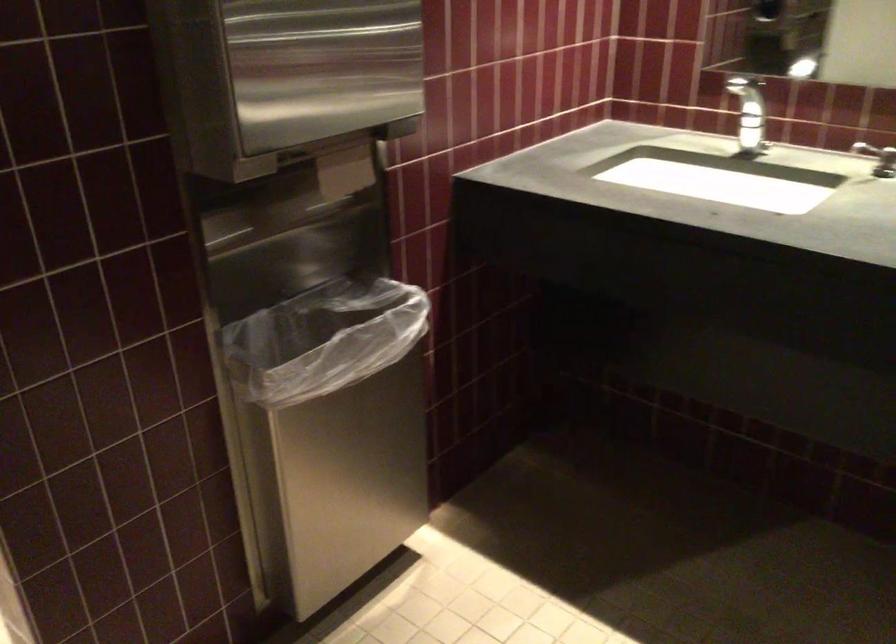
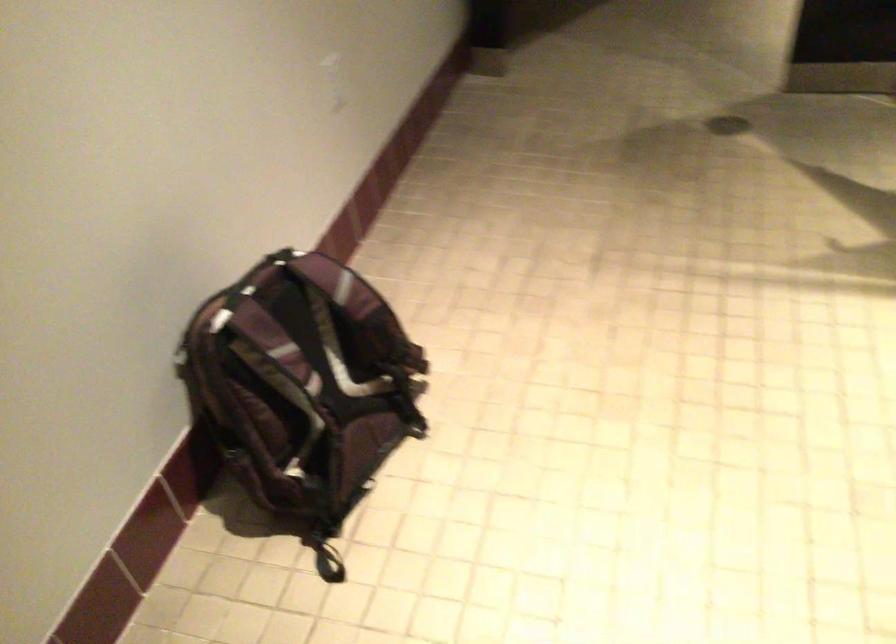
Based on the photo, first-person continuous shooting, in which direction is the camera rotating?

The camera rotated toward left-down.